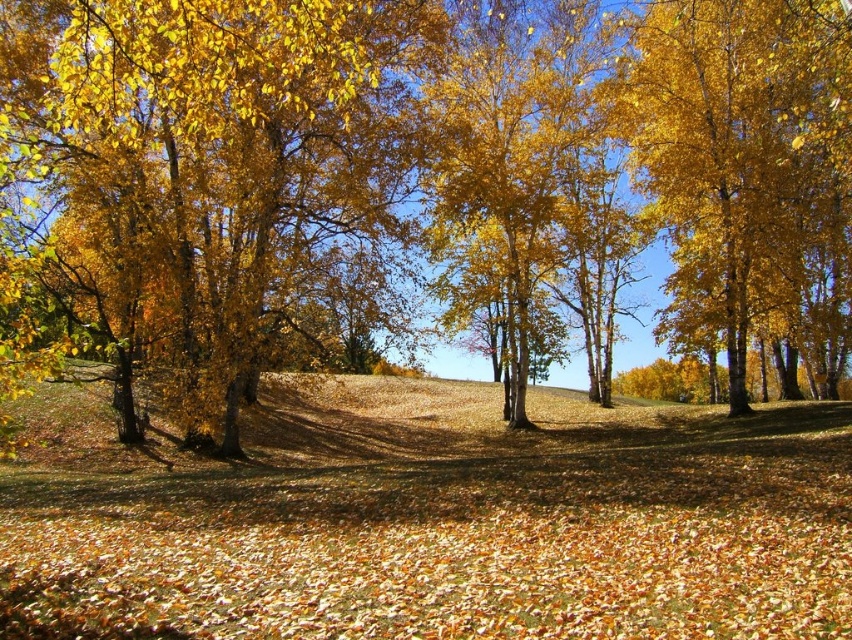
Question: Which point is closer to the camera?

Choices:
 (A) golden smooth tree at right
 (B) golden textured tree at left

Answer: (B)

Question: Which point appears farthest from the camera in this image?

Choices:
 (A) (78, 202)
 (B) (804, 173)

Answer: (B)

Question: Does golden textured tree at left have a lesser width compared to golden smooth tree at right?

Choices:
 (A) no
 (B) yes

Answer: (B)

Question: Can you confirm if golden textured tree at left is positioned above golden smooth tree at right?

Choices:
 (A) no
 (B) yes

Answer: (B)

Question: In this image, where is golden textured tree at left located relative to golden smooth tree at right?

Choices:
 (A) left
 (B) right

Answer: (A)